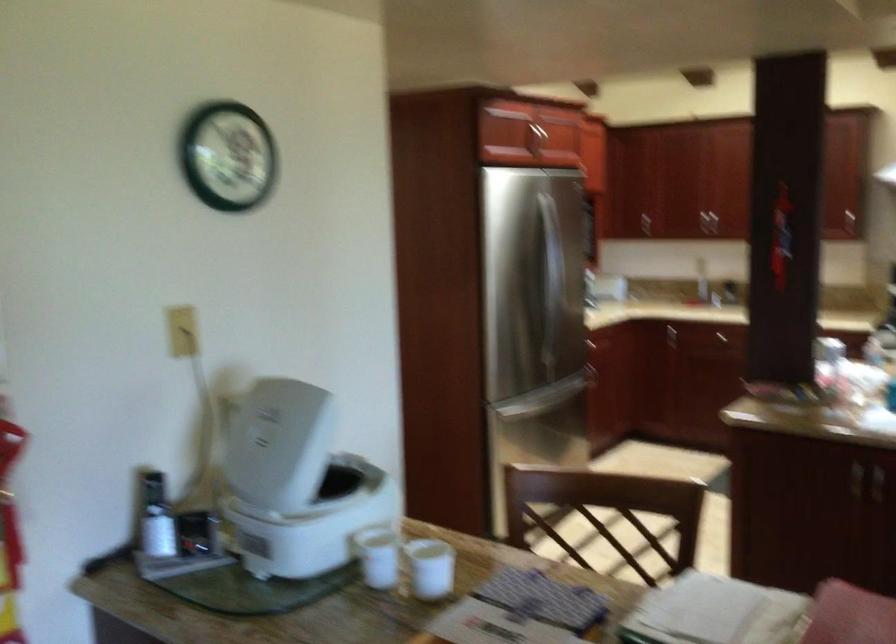
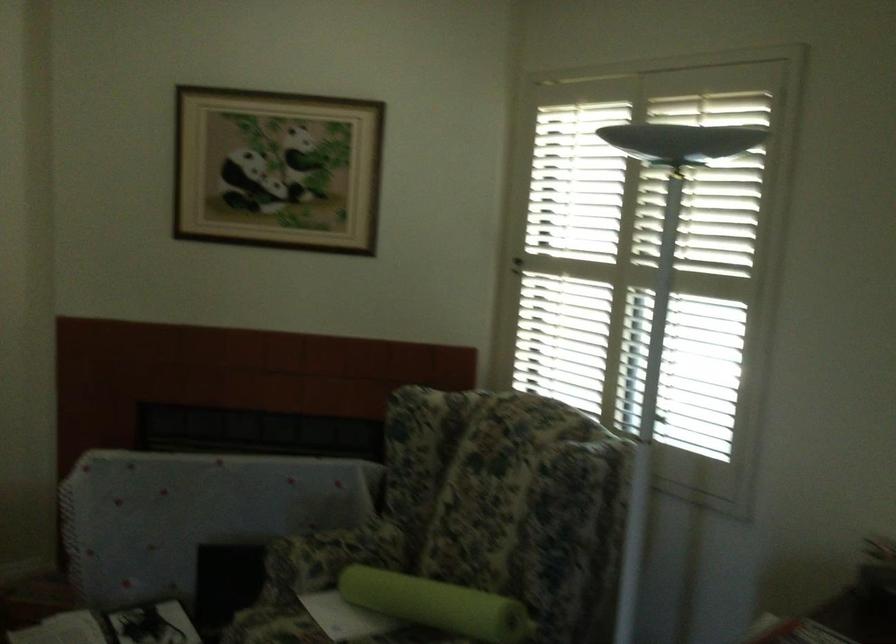
Question: The images are taken continuously from a first-person perspective. In which direction is your viewpoint rotating?

Choices:
 (A) Left
 (B) Right
 (C) Up
 (D) Down

Answer: (A)